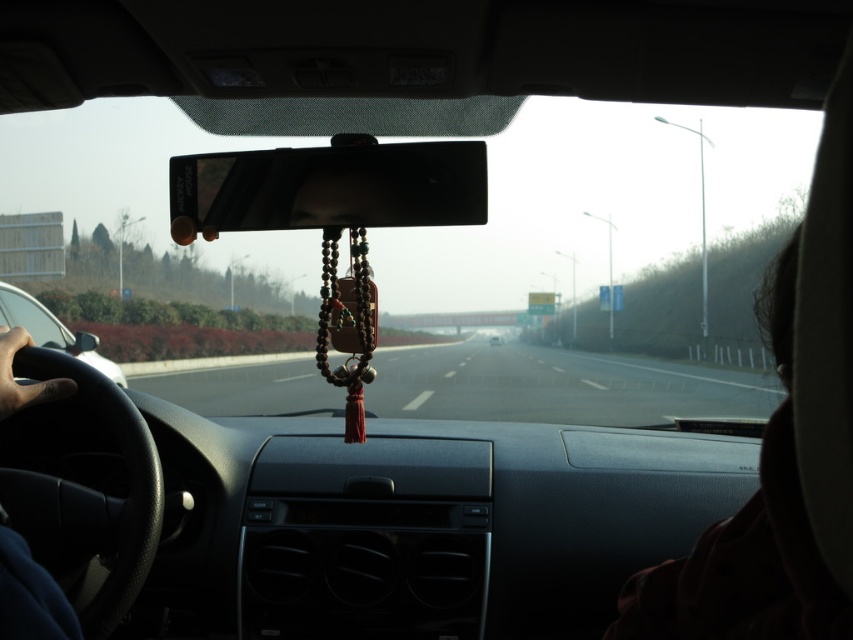
Between black glossy view mirror at center and black leather steering wheel at left, which one has less height?

With less height is black leather steering wheel at left.

Between black glossy view mirror at center and black leather steering wheel at left, which one is positioned lower?

black leather steering wheel at left

This screenshot has width=853, height=640. Describe the element at coordinates (328, 188) in the screenshot. I see `black glossy view mirror at center` at that location.

Where is `black glossy view mirror at center`? The height and width of the screenshot is (640, 853). black glossy view mirror at center is located at coordinates (328, 188).

Does point (683, 371) come closer to viewer compared to point (775, 269)?

No.

Consider the image. Who is shorter, asphalt road at center or dark hair at right?

dark hair at right is shorter.

Locate an element on the screen. The height and width of the screenshot is (640, 853). asphalt road at center is located at coordinates (556, 385).

At what (x,y) coordinates should I click in order to perform the action: click on asphalt road at center. Please return your answer as a coordinate pair (x, y). This screenshot has width=853, height=640. Looking at the image, I should click on 556,385.

Between black leather steering wheel at left and white glossy sedan at center, which one appears on the left side from the viewer's perspective?

black leather steering wheel at left is more to the left.

Looking at this image, does black leather steering wheel at left have a larger size compared to white glossy sedan at center?

Indeed, black leather steering wheel at left has a larger size compared to white glossy sedan at center.

Who is more forward, (26,307) or (492,339)?

Positioned in front is point (26,307).

Identify the location of black leather steering wheel at left. This screenshot has height=640, width=853. (51, 330).